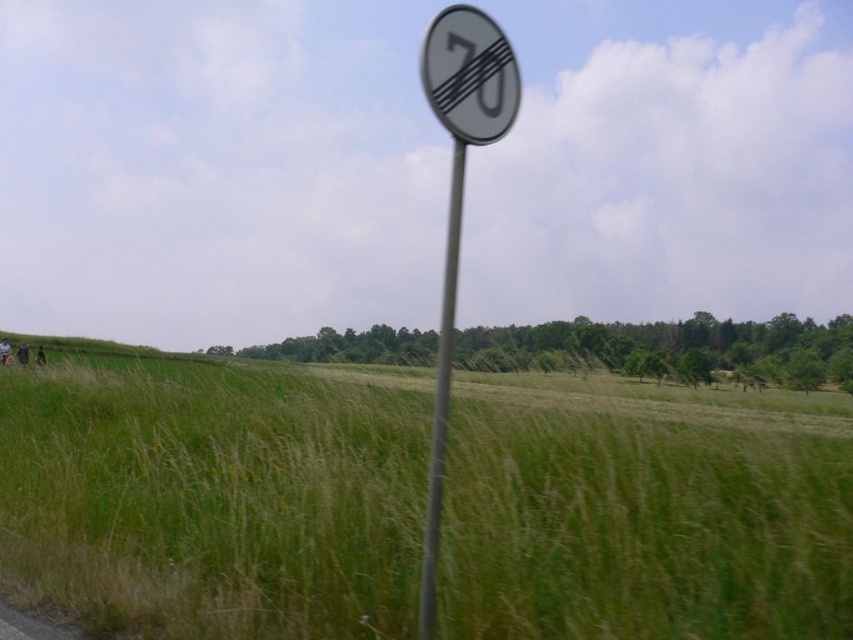
Is green grass at center thinner than metallic pole at center?

In fact, green grass at center might be wider than metallic pole at center.

Is point (181, 586) positioned in front of point (437, 436)?

That is False.

Between point (244, 624) and point (456, 236), which one is positioned in front?

Positioned in front is point (456, 236).

Where is `green grass at center`? The image size is (853, 640). green grass at center is located at coordinates (212, 499).

Can you confirm if green grass at center is bigger than white plastic speed limit sign at upper center?

Yes, green grass at center is bigger than white plastic speed limit sign at upper center.

Which is above, green grass at center or white plastic speed limit sign at upper center?

white plastic speed limit sign at upper center is higher up.

Is point (107, 592) positioned after point (502, 108)?

That is True.

Locate an element on the screen. green grass at center is located at coordinates (212, 499).

Which of these two, white plastic speed limit sign at upper center or metallic pole at center, stands shorter?

Standing shorter between the two is metallic pole at center.

Can you confirm if white plastic speed limit sign at upper center is smaller than metallic pole at center?

No.

Which is behind, point (473, 13) or point (428, 592)?

Point (473, 13)

Where is `white plastic speed limit sign at upper center`? Image resolution: width=853 pixels, height=640 pixels. white plastic speed limit sign at upper center is located at coordinates (469, 74).